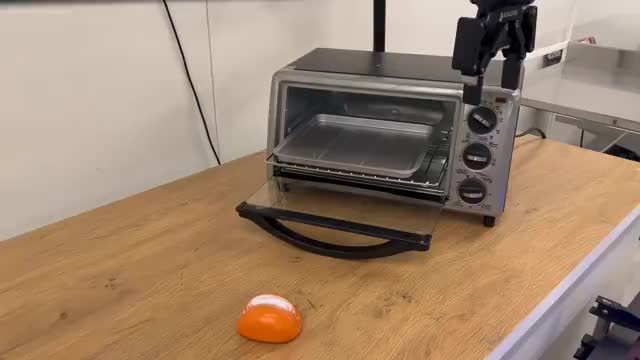
The width and height of the screenshot is (640, 360). In order to click on steel countertops in this screenshot , I will do `click(598, 98)`.